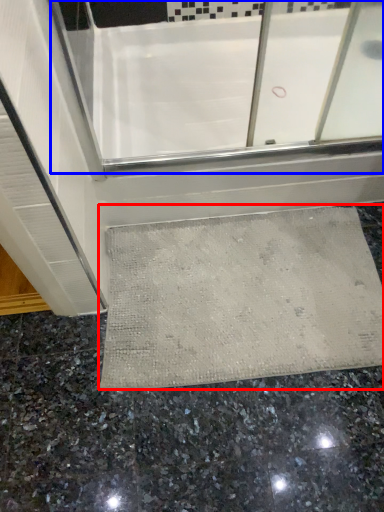
Question: Which object appears farthest to the camera in this image, bath mat (highlighted by a red box) or bath (highlighted by a blue box)?

Choices:
 (A) bath mat
 (B) bath

Answer: (B)